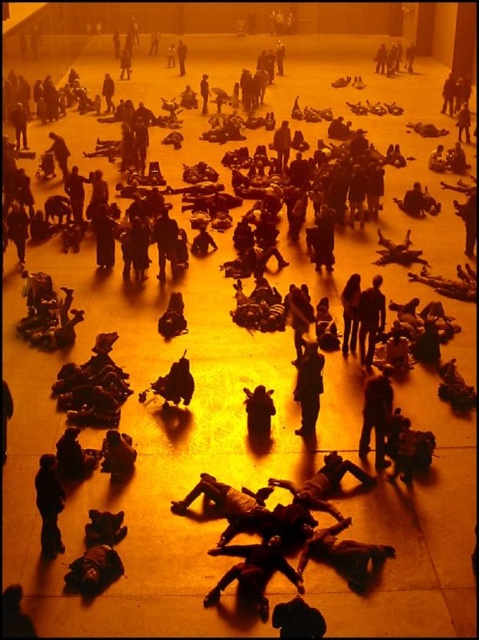
Question: Which object is closer to the camera taking this photo?

Choices:
 (A) dark gray fabric figure at lower left
 (B) dark brown leather bag at center

Answer: (A)

Question: Which point is farther to the camera?

Choices:
 (A) (269, 422)
 (B) (45, 506)
 (C) (311, 378)

Answer: (A)

Question: Can you confirm if dark gray fabric figure at lower left is bigger than dark brown leather bag at center?

Choices:
 (A) no
 (B) yes

Answer: (B)

Question: Which is farther from the dark brown leather jacket at center?

Choices:
 (A) dark brown leather bag at center
 (B) dark gray fabric figure at lower left

Answer: (B)

Question: Can you confirm if dark gray fabric figure at lower left is positioned to the right of dark brown leather bag at center?

Choices:
 (A) yes
 (B) no

Answer: (B)

Question: In this image, where is dark brown leather jacket at center located relative to dark brown leather bag at center?

Choices:
 (A) above
 (B) below

Answer: (A)